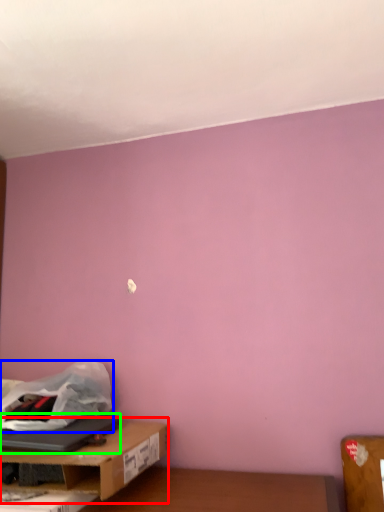
Question: Based on their relative distances, which object is farther from table (highlighted by a red box)? Choose from plastic bag (highlighted by a blue box) and laptop (highlighted by a green box).

Choices:
 (A) plastic bag
 (B) laptop

Answer: (A)